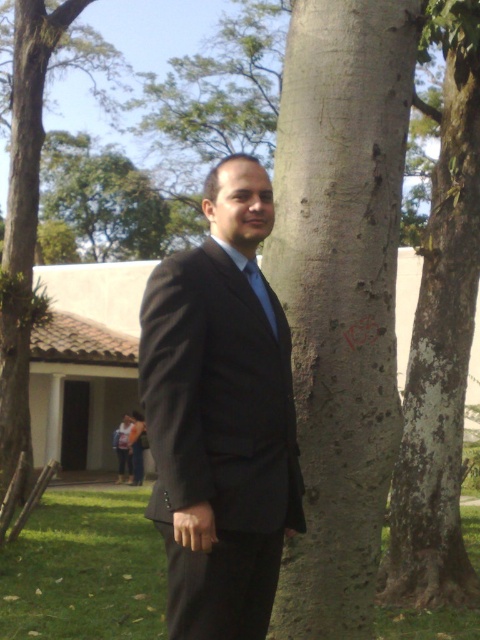
Question: Where is smooth bark tree trunk at center located in relation to blue satin tie at center in the image?

Choices:
 (A) above
 (B) below

Answer: (A)

Question: Is matte black suit at center wider than white textured bark at center?

Choices:
 (A) no
 (B) yes

Answer: (B)

Question: Which point is farther to the camera?

Choices:
 (A) (445, 525)
 (B) (261, 292)
 (C) (363, 182)

Answer: (A)

Question: Which point appears closest to the camera in this image?

Choices:
 (A) (309, 557)
 (B) (454, 333)
 (C) (269, 308)

Answer: (C)

Question: Is white textured bark at center wider than blue satin tie at center?

Choices:
 (A) yes
 (B) no

Answer: (A)

Question: Which object is closer to the camera taking this photo?

Choices:
 (A) blue satin tie at center
 (B) smooth bark tree trunk at center

Answer: (A)